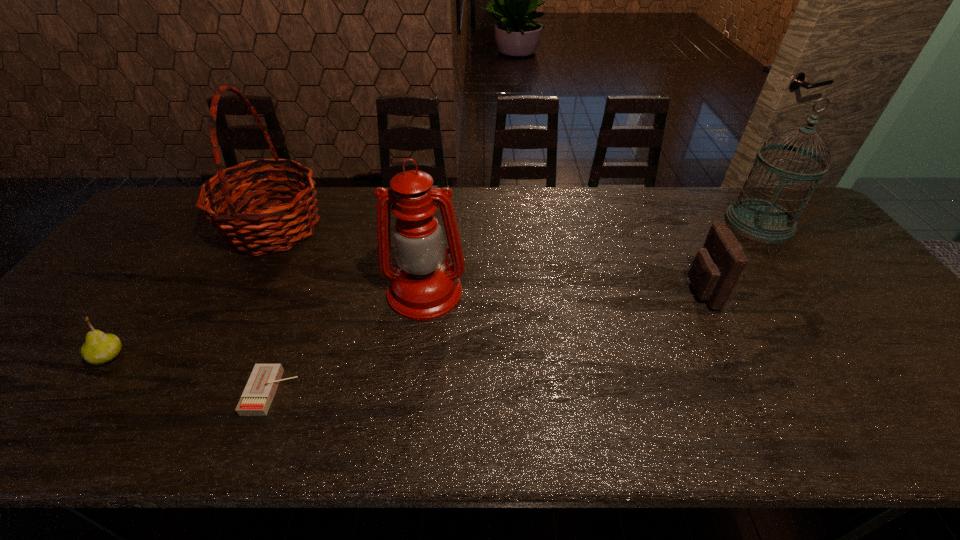
In order to click on blank space located 0.180m on the front of the third object from right to left in this screenshot , I will do `click(414, 383)`.

Identify the location of vacant space located 0.150m with an open flap on the third shortest object. (633, 291).

Find the location of a particular element. The height and width of the screenshot is (540, 960). vacant space located 0.170m with an open flap on the third shortest object is located at coordinates (625, 291).

Find the location of a particular element. The width and height of the screenshot is (960, 540). free space located with an open flap on the third shortest object is located at coordinates (670, 291).

At what (x,y) coordinates should I click in order to perform the action: click on vacant space located on the back of the pear. Please return your answer as a coordinate pair (x, y). Looking at the image, I should click on (189, 247).

Image resolution: width=960 pixels, height=540 pixels. I want to click on vacant space located 0.320m on the striking surface of the matchbox, so 440,392.

Locate an element on the screen. The image size is (960, 540). basket situated at the far edge is located at coordinates (243, 232).

Identify the location of birdcage located at the far edge. This screenshot has width=960, height=540. (759, 220).

What are the coordinates of `object present at the near edge` in the screenshot? It's located at click(x=260, y=389).

I want to click on object positioned at the left edge, so click(99, 348).